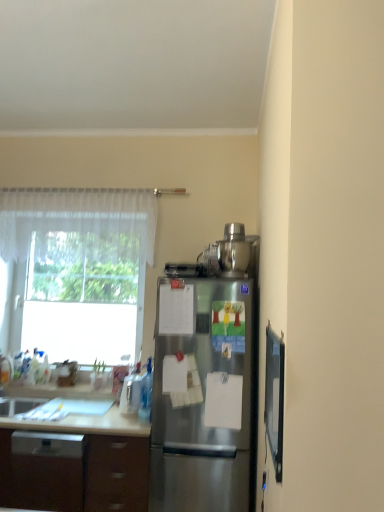
Measure the distance between brown wood cabinet at lower left and camera.

A distance of 8.44 feet exists between brown wood cabinet at lower left and camera.

What do you see at coordinates (232, 253) in the screenshot?
I see `stainless steel blender at upper right, which is the 2th appliance in left-to-right order` at bounding box center [232, 253].

Locate an element on the screen. clear plastic container at lower left, which appears as the 1th appliance when viewed from the left is located at coordinates (130, 394).

Describe the element at coordinates (116, 473) in the screenshot. This screenshot has height=512, width=384. I see `brown matte drawer at lower left` at that location.

Find the location of a particular element. Image resolution: width=384 pixels, height=512 pixels. matte black screen door at right is located at coordinates (274, 397).

I want to click on brown wood cabinet at lower left, so coord(79,476).

Considering the positions of objects matte black screen door at right and brown wood cabinet at lower left in the image provided, who is behind, matte black screen door at right or brown wood cabinet at lower left?

Positioned behind is brown wood cabinet at lower left.

Is matte black screen door at right turned away from brown wood cabinet at lower left?

matte black screen door at right is not turned away from brown wood cabinet at lower left.

From the picture: From the image's perspective, who appears lower, matte black screen door at right or brown wood cabinet at lower left?

brown wood cabinet at lower left.

Can you confirm if matte black screen door at right is positioned to the right of brown wood cabinet at lower left?

Correct, you'll find matte black screen door at right to the right of brown wood cabinet at lower left.

From a real-world perspective, who is located higher, clear plastic container at lower left, which is the first appliance from bottom to top, or brown matte drawer at lower left?

From a 3D spatial view, clear plastic container at lower left, which is the first appliance from bottom to top, is above.

Is clear plastic container at lower left, positioned as the second appliance in top-to-bottom order, positioned with its back to brown matte drawer at lower left?

No, brown matte drawer at lower left is not at the back of clear plastic container at lower left, positioned as the second appliance in top-to-bottom order.

What's the angular difference between clear plastic container at lower left, which appears as the 1th appliance when viewed from the left, and brown matte drawer at lower left's facing directions?

They differ by 4.44 degrees in their facing directions.

Is clear plastic container at lower left, which is the 2th appliance from right to left, far from brown matte drawer at lower left?

They are positioned close to each other.

Does sheer white curtain at upper left come behind brown wood cabinet at lower left?

Yes, the depth of sheer white curtain at upper left is greater than that of brown wood cabinet at lower left.

Considering the sizes of objects sheer white curtain at upper left and brown wood cabinet at lower left in the image provided, who is shorter, sheer white curtain at upper left or brown wood cabinet at lower left?

With less height is sheer white curtain at upper left.

Is sheer white curtain at upper left to the left of brown wood cabinet at lower left from the viewer's perspective?

No.

Which is nearer, (279,430) or (151,259)?

The point (279,430) is closer to the camera.

Would you consider matte black screen door at right to be distant from transparent glass window at left?

matte black screen door at right is positioned a significant distance from transparent glass window at left.

Is matte black screen door at right at the left side of transparent glass window at left?

In fact, matte black screen door at right is to the right of transparent glass window at left.

Would you consider brown matte drawer at lower left to be distant from clear plastic container at lower left, positioned as the second appliance in top-to-bottom order?

Answer: No, brown matte drawer at lower left is not far from clear plastic container at lower left, positioned as the second appliance in top-to-bottom order.

Between brown matte drawer at lower left and clear plastic container at lower left, which is the first appliance from bottom to top, which one has smaller size?

Smaller between the two is clear plastic container at lower left, which is the first appliance from bottom to top.

Does brown matte drawer at lower left have a greater height compared to clear plastic container at lower left, which is the 2th appliance from right to left?

Correct, brown matte drawer at lower left is much taller as clear plastic container at lower left, which is the 2th appliance from right to left.

In the image, is brown matte drawer at lower left on the left side or the right side of clear plastic container at lower left, which appears as the 1th appliance when viewed from the left?

From the image, it's evident that brown matte drawer at lower left is to the left of clear plastic container at lower left, which appears as the 1th appliance when viewed from the left.

Can you confirm if stainless steel refrigerator at center is thinner than stainless steel blender at upper right, marked as the 1th appliance in a top-to-bottom arrangement?

In fact, stainless steel refrigerator at center might be wider than stainless steel blender at upper right, marked as the 1th appliance in a top-to-bottom arrangement.

Considering the points (182, 504) and (233, 251), which point is in front, point (182, 504) or point (233, 251)?

The point (182, 504) is in front.

From the image's perspective, which one is positioned higher, stainless steel refrigerator at center or stainless steel blender at upper right, positioned as the 1th appliance in right-to-left order?

stainless steel blender at upper right, positioned as the 1th appliance in right-to-left order, is shown above in the image.

Does clear plastic container at lower left, which is the 2th appliance from right to left, touch transparent glass window at left?

There is a gap between clear plastic container at lower left, which is the 2th appliance from right to left, and transparent glass window at left.

How many degrees apart are the facing directions of clear plastic container at lower left, which appears as the 1th appliance when viewed from the left, and transparent glass window at left?

The angular difference between clear plastic container at lower left, which appears as the 1th appliance when viewed from the left, and transparent glass window at left is 85.6 degrees.

The height and width of the screenshot is (512, 384). I want to click on the 1st appliance in front of the transparent glass window at left, so click(130, 394).

Identify the location of cabinetry on the left of matte black screen door at right. Image resolution: width=384 pixels, height=512 pixels. (79, 476).

From the brown matte drawer at lower left, count 1st appliance to the right and point to it. Please provide its 2D coordinates.

[(130, 394)]

Which object lies further to the anchor point clear plastic container at lower left, positioned as the second appliance in top-to-bottom order, stainless steel refrigerator at center or transparent glass window at left?

Among the two, transparent glass window at left is located further to clear plastic container at lower left, positioned as the second appliance in top-to-bottom order.

Estimate the real-world distances between objects in this image. Which object is further from stainless steel refrigerator at center, stainless steel blender at upper right, positioned as the 1th appliance in right-to-left order, or clear plastic container at lower left, which appears as the 1th appliance when viewed from the left?

stainless steel blender at upper right, positioned as the 1th appliance in right-to-left order.

When comparing their distances from transparent glass window at left, does sheer white curtain at upper left or matte black screen door at right seem further?

matte black screen door at right lies further to transparent glass window at left than the other object.

From the image, which object appears to be farther from brown wood cabinet at lower left, sheer white curtain at upper left or brown matte drawer at lower left?

sheer white curtain at upper left is positioned further to the anchor brown wood cabinet at lower left.

Based on their spatial positions, is clear plastic container at lower left, which appears as the 1th appliance when viewed from the left, or brown wood cabinet at lower left further from matte black screen door at right?

brown wood cabinet at lower left lies further to matte black screen door at right than the other object.

Based on their spatial positions, is stainless steel refrigerator at center or clear plastic container at lower left, which appears as the 1th appliance when viewed from the left, further from brown wood cabinet at lower left?

stainless steel refrigerator at center lies further to brown wood cabinet at lower left than the other object.

From the image, which object appears to be farther from brown matte drawer at lower left, stainless steel blender at upper right, which is the 2th appliance in left-to-right order, or stainless steel refrigerator at center?

stainless steel blender at upper right, which is the 2th appliance in left-to-right order, is further to brown matte drawer at lower left.

Looking at the image, which one is located closer to stainless steel blender at upper right, positioned as the 1th appliance in right-to-left order, brown wood cabinet at lower left or clear plastic container at lower left, positioned as the second appliance in top-to-bottom order?

Among the two, clear plastic container at lower left, positioned as the second appliance in top-to-bottom order, is located nearer to stainless steel blender at upper right, positioned as the 1th appliance in right-to-left order.

Identify the location of cabinetry between stainless steel blender at upper right, which appears as the second appliance when ordered from the bottom, and brown matte drawer at lower left in the up-down direction. The height and width of the screenshot is (512, 384). (79, 476).

I want to click on appliance between stainless steel blender at upper right, marked as the 1th appliance in a top-to-bottom arrangement, and brown matte drawer at lower left vertically, so click(x=130, y=394).

This screenshot has width=384, height=512. Find the location of `drawer located between brown wood cabinet at lower left and transparent glass window at left in the depth direction`. drawer located between brown wood cabinet at lower left and transparent glass window at left in the depth direction is located at coordinates (116, 473).

Locate an element on the screen. Image resolution: width=384 pixels, height=512 pixels. window between sheer white curtain at upper left and brown matte drawer at lower left from top to bottom is located at coordinates (77, 271).